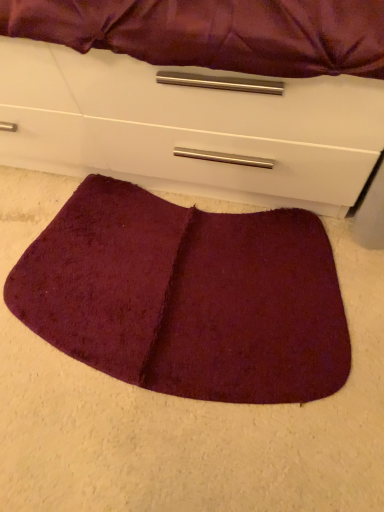
The height and width of the screenshot is (512, 384). I want to click on burgundy plush mat at lower center, so click(x=187, y=296).

Measure the distance between burgundy plush mat at lower center and camera.

The depth of burgundy plush mat at lower center is 33.46 inches.

What do you see at coordinates (187, 296) in the screenshot? The width and height of the screenshot is (384, 512). I see `burgundy plush mat at lower center` at bounding box center [187, 296].

The width and height of the screenshot is (384, 512). What are the coordinates of `matte white chest of drawers at lower center` in the screenshot? It's located at (190, 127).

What do you see at coordinates (190, 127) in the screenshot?
I see `matte white chest of drawers at lower center` at bounding box center [190, 127].

Identify the location of burgundy plush mat at lower center. (187, 296).

In the scene shown: Considering the relative positions of burgundy plush mat at lower center and matte white chest of drawers at lower center in the image provided, is burgundy plush mat at lower center to the right of matte white chest of drawers at lower center from the viewer's perspective?

Correct, you'll find burgundy plush mat at lower center to the right of matte white chest of drawers at lower center.

Considering the positions of objects burgundy plush mat at lower center and matte white chest of drawers at lower center in the image provided, who is in front, burgundy plush mat at lower center or matte white chest of drawers at lower center?

matte white chest of drawers at lower center is more forward.

Is point (71, 244) closer to camera compared to point (270, 200)?

No, it is not.

From the image's perspective, would you say burgundy plush mat at lower center is shown under matte white chest of drawers at lower center?

Correct, burgundy plush mat at lower center appears lower than matte white chest of drawers at lower center in the image.

From a real-world perspective, relative to matte white chest of drawers at lower center, is burgundy plush mat at lower center vertically above or below?

In terms of real-world spatial position, burgundy plush mat at lower center is below matte white chest of drawers at lower center.

From the picture: Which of these two, burgundy plush mat at lower center or matte white chest of drawers at lower center, is wider?

Wider between the two is matte white chest of drawers at lower center.

Between burgundy plush mat at lower center and matte white chest of drawers at lower center, which one has more height?

matte white chest of drawers at lower center is taller.

Who is bigger, burgundy plush mat at lower center or matte white chest of drawers at lower center?

matte white chest of drawers at lower center is bigger.

Is burgundy plush mat at lower center surrounding matte white chest of drawers at lower center?

No, matte white chest of drawers at lower center is not a part of burgundy plush mat at lower center.

Is burgundy plush mat at lower center in contact with matte white chest of drawers at lower center?

No, burgundy plush mat at lower center is not touching matte white chest of drawers at lower center.

Is burgundy plush mat at lower center oriented towards matte white chest of drawers at lower center?

No, burgundy plush mat at lower center is not oriented towards matte white chest of drawers at lower center.

In the image, there is a matte white chest of drawers at lower center. Where is `mat below it (from a real-world perspective)`? mat below it (from a real-world perspective) is located at coordinates (187, 296).

Is matte white chest of drawers at lower center at the right side of burgundy plush mat at lower center?

No, matte white chest of drawers at lower center is not to the right of burgundy plush mat at lower center.

Who is more distant, matte white chest of drawers at lower center or burgundy plush mat at lower center?

burgundy plush mat at lower center is further from the camera.

Which is nearer, (246, 187) or (133, 273)?

Positioned in front is point (246, 187).

From the image's perspective, is matte white chest of drawers at lower center below burgundy plush mat at lower center?

No, from the image's perspective, matte white chest of drawers at lower center is not below burgundy plush mat at lower center.

From a real-world perspective, is matte white chest of drawers at lower center below burgundy plush mat at lower center?

No, from a real-world perspective, matte white chest of drawers at lower center is not beneath burgundy plush mat at lower center.

Based on the photo, looking at their sizes, would you say matte white chest of drawers at lower center is wider or thinner than burgundy plush mat at lower center?

Considering their sizes, matte white chest of drawers at lower center looks broader than burgundy plush mat at lower center.

Considering the sizes of matte white chest of drawers at lower center and burgundy plush mat at lower center in the image, is matte white chest of drawers at lower center taller or shorter than burgundy plush mat at lower center?

In the image, matte white chest of drawers at lower center appears to be taller than burgundy plush mat at lower center.

Is matte white chest of drawers at lower center smaller than burgundy plush mat at lower center?

No, matte white chest of drawers at lower center is not smaller than burgundy plush mat at lower center.

Is matte white chest of drawers at lower center situated inside burgundy plush mat at lower center or outside?

The correct answer is: outside.

Is matte white chest of drawers at lower center positioned far away from burgundy plush mat at lower center?

No, matte white chest of drawers at lower center is in close proximity to burgundy plush mat at lower center.

Is matte white chest of drawers at lower center turned away from burgundy plush mat at lower center?

That's not correct — matte white chest of drawers at lower center is not looking away from burgundy plush mat at lower center.

How different are the orientations of matte white chest of drawers at lower center and burgundy plush mat at lower center in degrees?

0.214 degrees separate the facing orientations of matte white chest of drawers at lower center and burgundy plush mat at lower center.

Where is `the chest of drawers that is above the burgundy plush mat at lower center (from the image's perspective)`? the chest of drawers that is above the burgundy plush mat at lower center (from the image's perspective) is located at coordinates (190, 127).

Where is `chest of drawers above the burgundy plush mat at lower center (from the image's perspective)`? This screenshot has height=512, width=384. chest of drawers above the burgundy plush mat at lower center (from the image's perspective) is located at coordinates (190, 127).

Where is `mat that is below the matte white chest of drawers at lower center (from the image's perspective)`? This screenshot has height=512, width=384. mat that is below the matte white chest of drawers at lower center (from the image's perspective) is located at coordinates (187, 296).